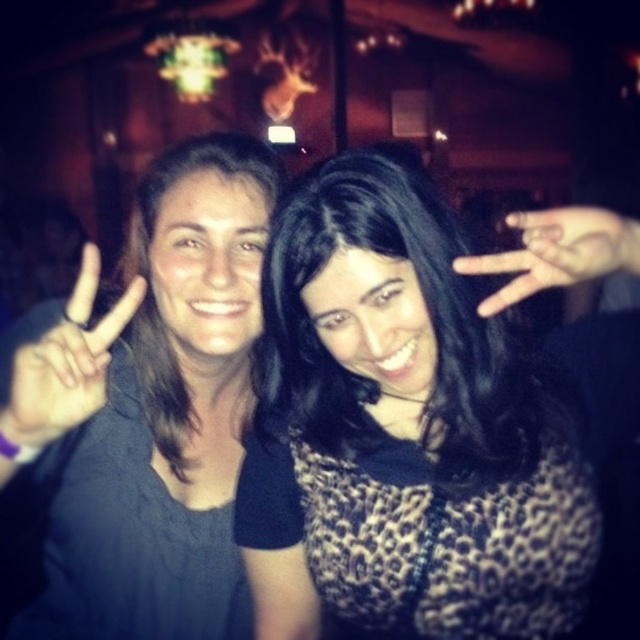
You are a photographer adjusting your camera settings to focus on the dark gray sweater at left and the matte black hand at center. Which object should you focus on first if you want to capture both in sharp detail?

The dark gray sweater at left is positioned on the left side of matte black hand at center, so you should focus on the dark gray sweater at left first to ensure both are in sharp detail.

In the scene shown: You are a photographer adjusting the camera settings to capture a clear photo of both the dark gray sweater at left and the matte black hand at center. Given the camera has a depth of field that can focus on objects within 18 inches of each other, will both objects be in focus?

The dark gray sweater at left and matte black hand at center are 20.35 inches apart, which exceeds the camera depth of field limit of 18 inches. Therefore, both objects cannot be in focus simultaneously.

You are a photographer adjusting your camera settings to focus on the dark gray sweater at left and the black matte hand at left. Which object should you focus on first to ensure proper depth of field?

You should focus on the dark gray sweater at left first because it is closer to the viewer than the black matte hand at left, allowing the camera to establish the correct depth of field before adjusting for the background elements.